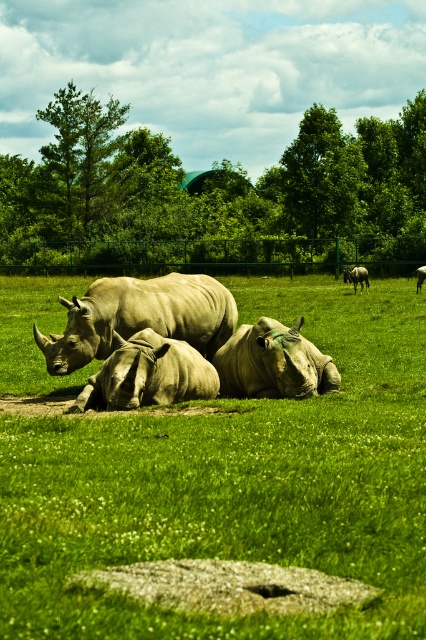
Between smooth beige rhino at center and green leafy tree at upper left, which one appears on the left side from the viewer's perspective?

green leafy tree at upper left is more to the left.

Is point (207, 316) in front of point (66, 109)?

Yes, it is in front of point (66, 109).

Which is behind, point (155, 330) or point (62, 129)?

Point (62, 129)

Where is `smooth beige rhino at center`? smooth beige rhino at center is located at coordinates (140, 317).

Does grayish-brown rhino at center appear under gray matte rhinoceros at center?

No.

Is point (339, 538) in front of point (160, 394)?

That is True.

Between point (20, 388) and point (152, 340), which one is positioned in front?

Positioned in front is point (152, 340).

At what (x,y) coordinates should I click in order to perform the action: click on grayish-brown rhino at center. Please return your answer as a coordinate pair (x, y). The width and height of the screenshot is (426, 640). Looking at the image, I should click on (236, 484).

Can you confirm if smooth gray rhino at center is wider than light gray matte rhino at right?

Yes, smooth gray rhino at center is wider than light gray matte rhino at right.

Is smooth gray rhino at center taller than light gray matte rhino at right?

Yes, smooth gray rhino at center is taller than light gray matte rhino at right.

The width and height of the screenshot is (426, 640). I want to click on smooth gray rhino at center, so click(x=273, y=362).